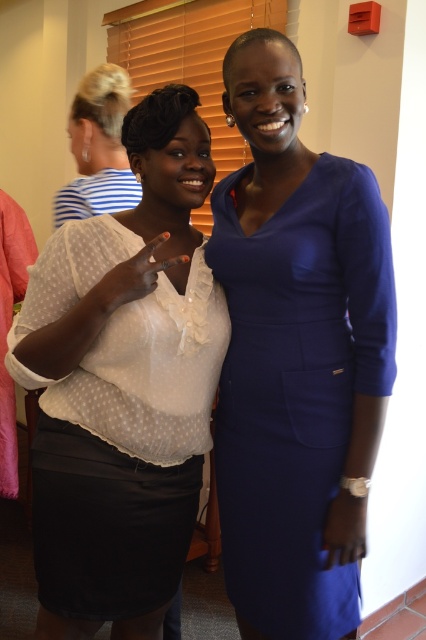
In the scene shown: You are standing in the room and want to move closer to both the point at location (173, 388) and the point at (342, 256). Which point will you reach first as you move forward?

You will reach the point at location (173, 388) first because it is closer to you than the point at (342, 256), which is further away.